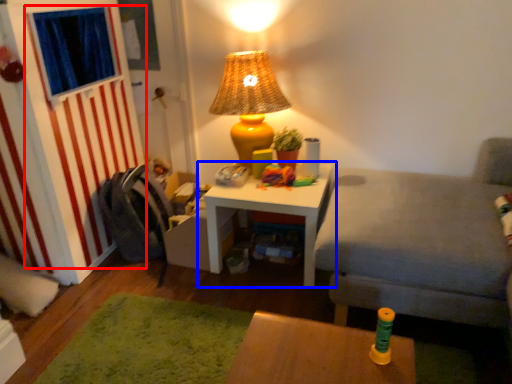
Question: Which object is closer to the camera taking this photo, curtain (highlighted by a red box) or table (highlighted by a blue box)?

Choices:
 (A) curtain
 (B) table

Answer: (A)